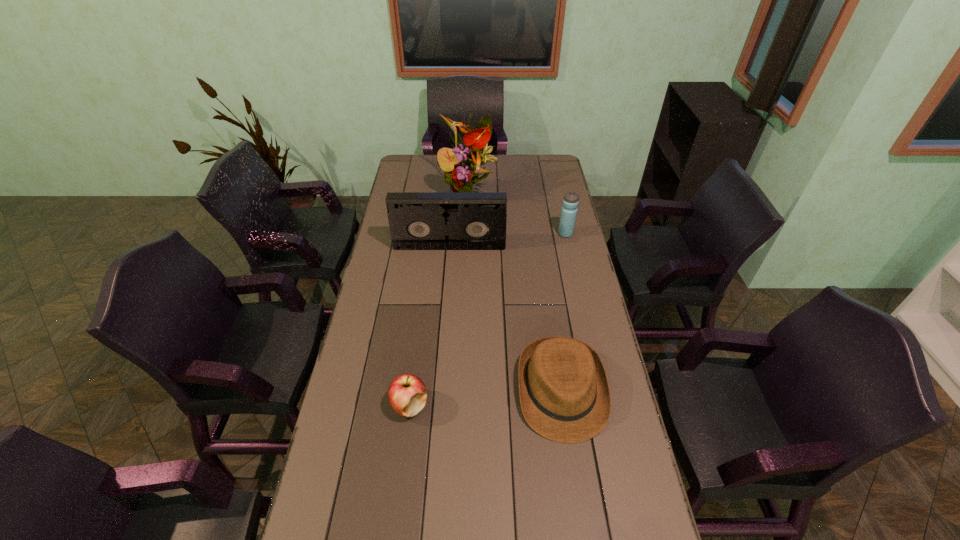
This screenshot has height=540, width=960. In order to click on the tallest object in this screenshot , I will do `click(462, 165)`.

What are the coordinates of `the farthest object` in the screenshot? It's located at (462, 165).

This screenshot has width=960, height=540. Identify the location of videotape. point(417,220).

I want to click on the fourth shortest object, so click(x=417, y=220).

At what (x,y) coordinates should I click in order to perform the action: click on water bottle. Please return your answer as a coordinate pair (x, y). This screenshot has height=540, width=960. Looking at the image, I should click on (570, 202).

Locate an element on the screen. the third tallest object is located at coordinates (570, 202).

What are the coordinates of `apple` in the screenshot? It's located at (407, 394).

You are a GUI agent. You are given a task and a screenshot of the screen. Output one action in this format:
    pyautogui.click(x=<x>, y=<y>)
    Task: Click on the fedora
    The image size is (960, 540).
    Given the screenshot: What is the action you would take?
    (x=564, y=393)

Image resolution: width=960 pixels, height=540 pixels. In order to click on free space located on the front-facing side of the farthest object in this screenshot , I will do `click(467, 241)`.

Locate an element on the screen. The height and width of the screenshot is (540, 960). blank space located 0.240m on the front side of the second tallest object is located at coordinates (446, 293).